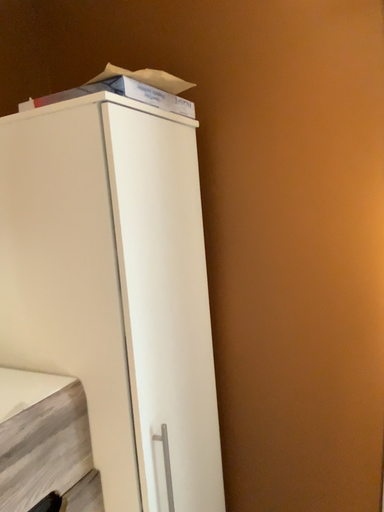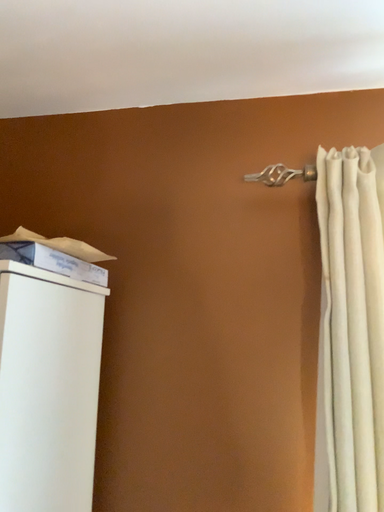
Question: How did the camera likely rotate when shooting the video?

Choices:
 (A) rotated downward
 (B) rotated upward

Answer: (B)